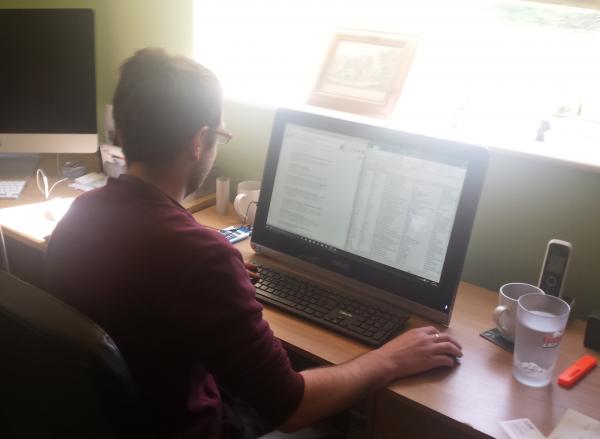
Image resolution: width=600 pixels, height=439 pixels. In order to click on wireless telephone in this screenshot , I will do 552,268.